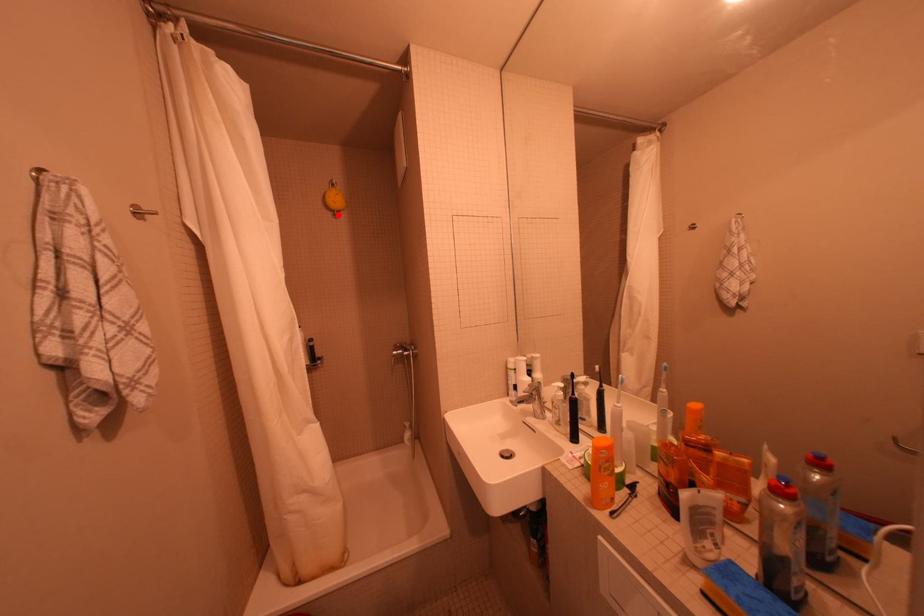
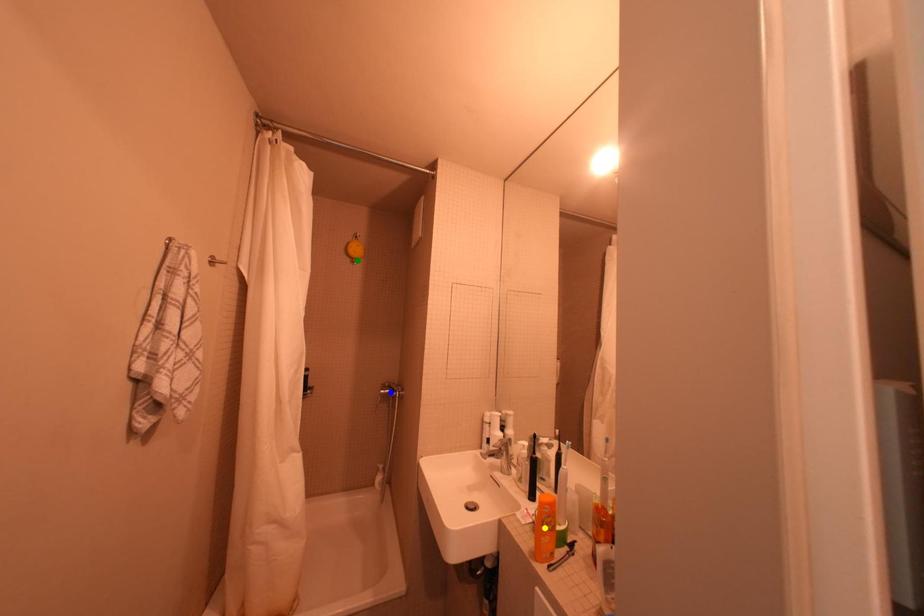
Question: I am providing you with two images of the same scene from different viewpoints. A red point is marked on the first image. You are given multiple points on the second image. Which point in image 2 represents the same 3d spot as the red point in image 1?

Choices:
 (A) yellow point
 (B) green point
 (C) blue point

Answer: (B)